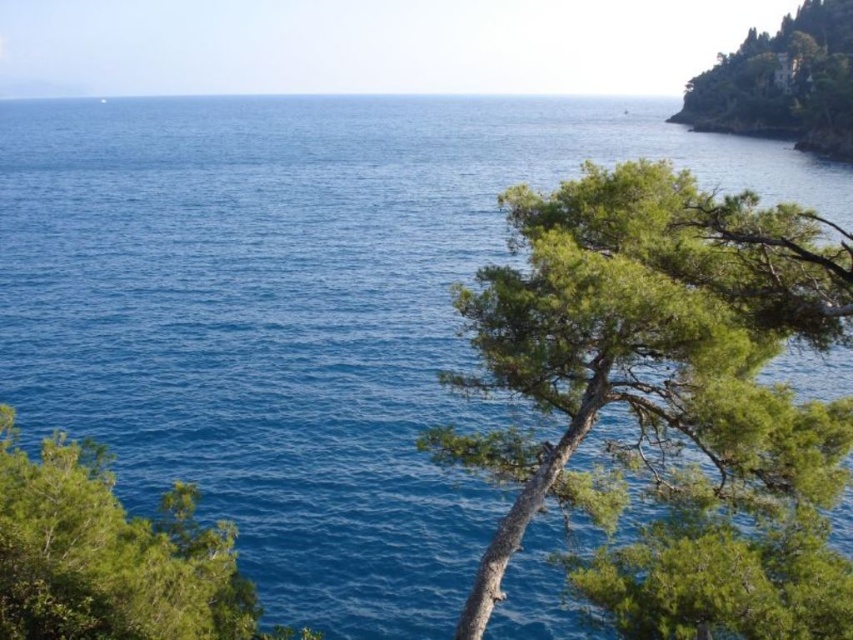
Question: Considering the real-world distances, which object is farthest from the green leafy tree at lower left?

Choices:
 (A) green textured tree at right
 (B) green leafy tree at upper right

Answer: (B)

Question: Can you confirm if green textured tree at right is positioned below green leafy tree at upper right?

Choices:
 (A) no
 (B) yes

Answer: (B)

Question: Can you confirm if green textured tree at right is smaller than green leafy tree at upper right?

Choices:
 (A) yes
 (B) no

Answer: (A)

Question: Which point is closer to the camera taking this photo?

Choices:
 (A) (74, 541)
 (B) (581, 563)
 (C) (703, 90)

Answer: (A)

Question: Which of these objects is positioned farthest from the green leafy tree at lower left?

Choices:
 (A) green textured tree at right
 (B) green leafy tree at upper right

Answer: (B)

Question: Is green leafy tree at lower left above green leafy tree at upper right?

Choices:
 (A) no
 (B) yes

Answer: (A)